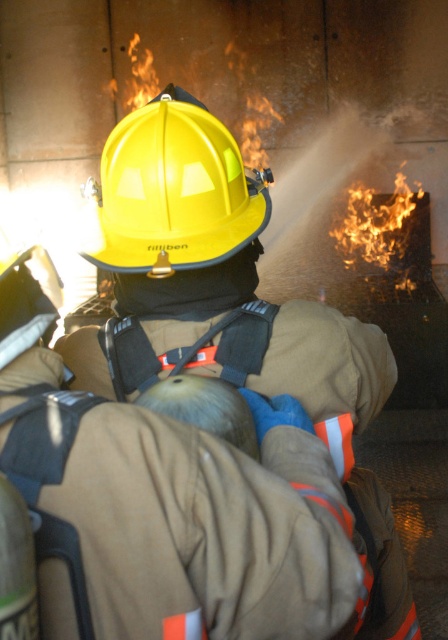
Can you confirm if yellow hard hat at center is taller than yellow matte helmet at center?

Yes.

Between yellow hard hat at center and yellow matte helmet at center, which one has less height?

With less height is yellow matte helmet at center.

Describe the element at coordinates (229, 312) in the screenshot. The width and height of the screenshot is (448, 640). I see `yellow hard hat at center` at that location.

At what (x,y) coordinates should I click in order to perform the action: click on yellow hard hat at center. Please return your answer as a coordinate pair (x, y). Looking at the image, I should click on (229, 312).

Based on the photo, is yellow hard hat at center further to camera compared to yellow hard hat at upper center?

No, it is in front of yellow hard hat at upper center.

Can you confirm if yellow hard hat at center is positioned above yellow hard hat at upper center?

No, yellow hard hat at center is not above yellow hard hat at upper center.

Identify the location of yellow hard hat at center. The width and height of the screenshot is (448, 640). (229, 312).

The width and height of the screenshot is (448, 640). I want to click on yellow hard hat at center, so click(x=229, y=312).

Does yellow matte helmet at center lie in front of yellow hard hat at upper center?

That is True.

From the picture: Who is more distant from viewer, (241, 204) or (278, 276)?

The point (278, 276) is behind.

Which is behind, point (202, 260) or point (324, 273)?

Positioned behind is point (324, 273).

Find the location of a particular element. The width and height of the screenshot is (448, 640). yellow matte helmet at center is located at coordinates (173, 189).